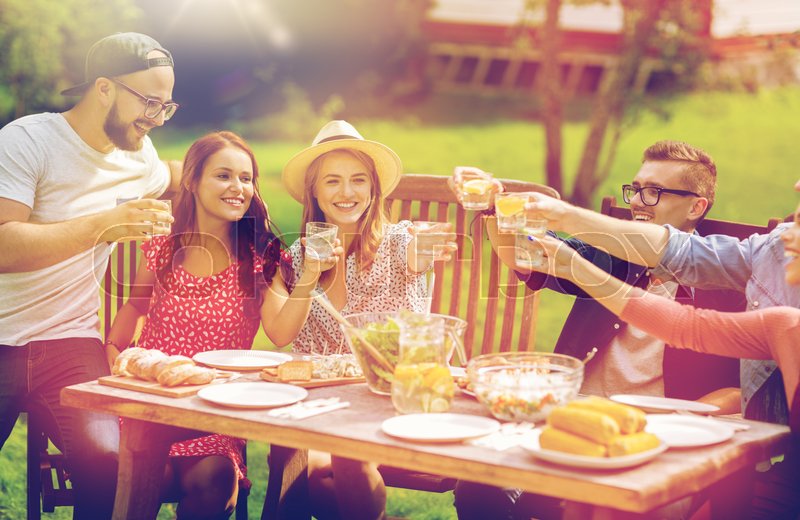
The width and height of the screenshot is (800, 520). I want to click on plates, so click(422, 424), click(252, 390), click(238, 346), click(638, 401), click(678, 431).